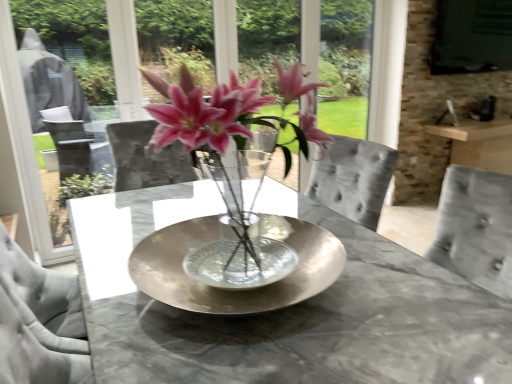
Question: Considering the relative sizes of black matte window screen at upper right and metallic silver bowl at center in the image provided, is black matte window screen at upper right smaller than metallic silver bowl at center?

Choices:
 (A) no
 (B) yes

Answer: (A)

Question: Is black matte window screen at upper right outside of metallic silver bowl at center?

Choices:
 (A) no
 (B) yes

Answer: (B)

Question: Can you confirm if black matte window screen at upper right is wider than metallic silver bowl at center?

Choices:
 (A) yes
 (B) no

Answer: (B)

Question: Considering the relative sizes of black matte window screen at upper right and metallic silver bowl at center in the image provided, is black matte window screen at upper right taller than metallic silver bowl at center?

Choices:
 (A) yes
 (B) no

Answer: (A)

Question: Is black matte window screen at upper right positioned before metallic silver bowl at center?

Choices:
 (A) yes
 (B) no

Answer: (B)

Question: Is black matte window screen at upper right oriented towards metallic silver bowl at center?

Choices:
 (A) yes
 (B) no

Answer: (B)

Question: From a real-world perspective, is pink glass vase at center positioned over metallic silver bowl at center based on gravity?

Choices:
 (A) yes
 (B) no

Answer: (A)

Question: Does pink glass vase at center come in front of metallic silver bowl at center?

Choices:
 (A) yes
 (B) no

Answer: (A)

Question: From the image's perspective, is pink glass vase at center over metallic silver bowl at center?

Choices:
 (A) yes
 (B) no

Answer: (A)

Question: Considering the relative sizes of pink glass vase at center and metallic silver bowl at center in the image provided, is pink glass vase at center thinner than metallic silver bowl at center?

Choices:
 (A) no
 (B) yes

Answer: (B)

Question: Does pink glass vase at center lie behind metallic silver bowl at center?

Choices:
 (A) yes
 (B) no

Answer: (B)

Question: Considering the relative sizes of pink glass vase at center and metallic silver bowl at center in the image provided, is pink glass vase at center bigger than metallic silver bowl at center?

Choices:
 (A) no
 (B) yes

Answer: (B)

Question: From the image's perspective, would you say metallic silver bowl at center is positioned over pink glass vase at center?

Choices:
 (A) yes
 (B) no

Answer: (B)